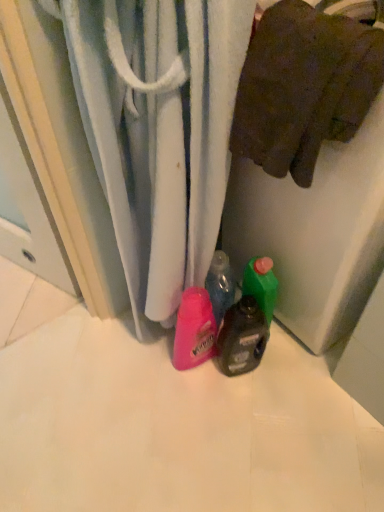
This screenshot has height=512, width=384. What do you see at coordinates (159, 130) in the screenshot?
I see `white textured towel at center` at bounding box center [159, 130].

Locate an element on the screen. white textured towel at center is located at coordinates (159, 130).

In the scene shown: Which is more to the right, brown cotton towel at upper right or white textured towel at center?

Positioned to the right is brown cotton towel at upper right.

Which of these two, brown cotton towel at upper right or white textured towel at center, is thinner?

brown cotton towel at upper right is thinner.

In the image, is brown cotton towel at upper right positioned in front of or behind white textured towel at center?

brown cotton towel at upper right is behind white textured towel at center.

Is brown cotton towel at upper right bigger or smaller than white textured towel at center?

brown cotton towel at upper right is smaller than white textured towel at center.

Is white textured towel at center positioned far away from brown cotton towel at upper right?

That's not correct — white textured towel at center is a little close to brown cotton towel at upper right.

Does white textured towel at center have a greater width compared to brown cotton towel at upper right?

Yes.

Looking at the image, does white textured towel at center seem bigger or smaller compared to brown cotton towel at upper right?

Considering their sizes, white textured towel at center takes up more space than brown cotton towel at upper right.

Is translucent plastic bottle at center shorter than white textured towel at center?

Yes, translucent plastic bottle at center is shorter than white textured towel at center.

Does translucent plastic bottle at center contain white textured towel at center?

No, white textured towel at center is not a part of translucent plastic bottle at center.

Who is smaller, translucent plastic bottle at center or white textured towel at center?

With smaller size is translucent plastic bottle at center.

Is translucent plastic bottle at center looking in the opposite direction of white textured towel at center?

No.

Based on the photo, is translucent plastic bottle at center bigger than brown cotton towel at upper right?

Incorrect, translucent plastic bottle at center is not larger than brown cotton towel at upper right.

Can you see translucent plastic bottle at center touching brown cotton towel at upper right?

translucent plastic bottle at center and brown cotton towel at upper right are not in contact.

Is translucent plastic bottle at center positioned with its back to brown cotton towel at upper right?

translucent plastic bottle at center is not turned away from brown cotton towel at upper right.

Considering the relative positions of white textured towel at center and translucent plastic bottle at center in the image provided, is white textured towel at center behind translucent plastic bottle at center?

No.

Is translucent plastic bottle at center at the back of white textured towel at center?

No, white textured towel at center is not facing away from translucent plastic bottle at center.

Consider the image. From the image's perspective, relative to translucent plastic bottle at center, is white textured towel at center above or below?

From the image's perspective, white textured towel at center appears above translucent plastic bottle at center.

Measure the distance between brown cotton towel at upper right and translucent plastic bottle at center.

19.33 inches.

Are brown cotton towel at upper right and translucent plastic bottle at center far apart?

No, brown cotton towel at upper right is in close proximity to translucent plastic bottle at center.

Which point is more distant from viewer, (356, 74) or (228, 336)?

Positioned behind is point (228, 336).

Who is taller, brown cotton towel at upper right or translucent plastic bottle at center?

Standing taller between the two is translucent plastic bottle at center.

At what (x,y) coordinates should I click in order to perform the action: click on towel above the white textured towel at center (from a real-world perspective). Please return your answer as a coordinate pair (x, y). Looking at the image, I should click on (303, 87).

I want to click on towel on the right of the white textured towel at center, so click(x=303, y=87).

Considering their positions, is white textured towel at center positioned closer to brown cotton towel at upper right than translucent plastic bottle at center?

white textured towel at center is positioned closer to the anchor brown cotton towel at upper right.

Which object lies further to the anchor point white textured towel at center, brown cotton towel at upper right or translucent plastic bottle at center?

Based on the image, translucent plastic bottle at center appears to be further to white textured towel at center.

Looking at the image, which one is located further to translucent plastic bottle at center, white textured towel at center or brown cotton towel at upper right?

brown cotton towel at upper right lies further to translucent plastic bottle at center than the other object.

Based on their spatial positions, is translucent plastic bottle at center or white textured towel at center further from brown cotton towel at upper right?

Based on the image, translucent plastic bottle at center appears to be further to brown cotton towel at upper right.

From the image, which object appears to be nearer to white textured towel at center, translucent plastic bottle at center or brown cotton towel at upper right?

Among the two, brown cotton towel at upper right is located nearer to white textured towel at center.

Considering their positions, is brown cotton towel at upper right positioned further to translucent plastic bottle at center than white textured towel at center?

The object further to translucent plastic bottle at center is brown cotton towel at upper right.

Locate an element on the screen. curtain between brown cotton towel at upper right and translucent plastic bottle at center vertically is located at coordinates (159, 130).